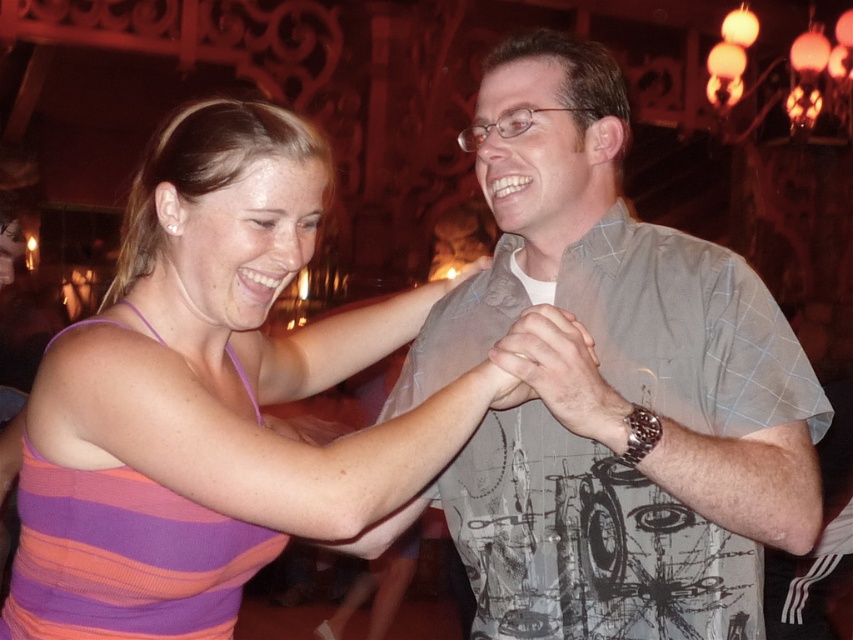
Can you confirm if striped tank top at center is positioned to the left of purple striped tank top at center?

Incorrect, striped tank top at center is not on the left side of purple striped tank top at center.

Does striped tank top at center appear on the right side of purple striped tank top at center?

Indeed, striped tank top at center is positioned on the right side of purple striped tank top at center.

Image resolution: width=853 pixels, height=640 pixels. What do you see at coordinates (239, 342) in the screenshot?
I see `striped tank top at center` at bounding box center [239, 342].

Image resolution: width=853 pixels, height=640 pixels. Identify the location of striped tank top at center. (239, 342).

Who is positioned more to the left, gray checkered shirt at center or striped tank top at center?

From the viewer's perspective, striped tank top at center appears more on the left side.

Is gray checkered shirt at center closer to camera compared to striped tank top at center?

No, gray checkered shirt at center is further to the viewer.

Is point (596, 308) farther from camera compared to point (234, 484)?

Yes, point (596, 308) is farther from viewer.

The height and width of the screenshot is (640, 853). I want to click on gray checkered shirt at center, so [x=611, y=387].

Who is shorter, gray checkered shirt at center or purple striped tank top at center?

purple striped tank top at center

Is gray checkered shirt at center positioned before purple striped tank top at center?

No, it is not.

Image resolution: width=853 pixels, height=640 pixels. What are the coordinates of `gray checkered shirt at center` in the screenshot? It's located at (611, 387).